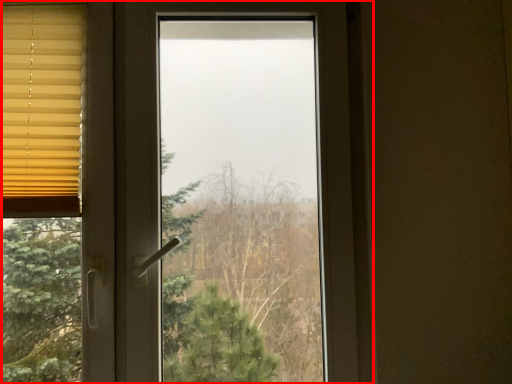
Question: Considering the relative positions of window (annotated by the red box) and window blind in the image provided, where is window (annotated by the red box) located with respect to the staircase?

Choices:
 (A) right
 (B) left

Answer: (A)